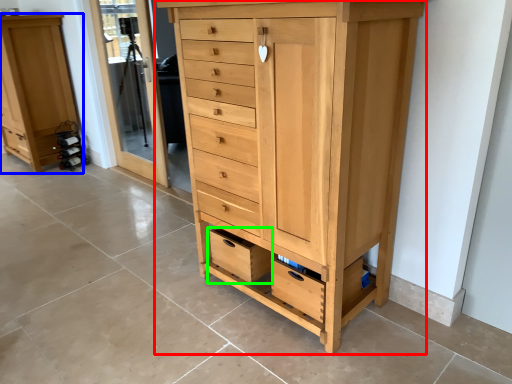
Question: Considering the real-world distances, which object is closest to chest of drawers (highlighted by a red box)? chest of drawers (highlighted by a blue box) or drawer (highlighted by a green box).

Choices:
 (A) chest of drawers
 (B) drawer

Answer: (B)